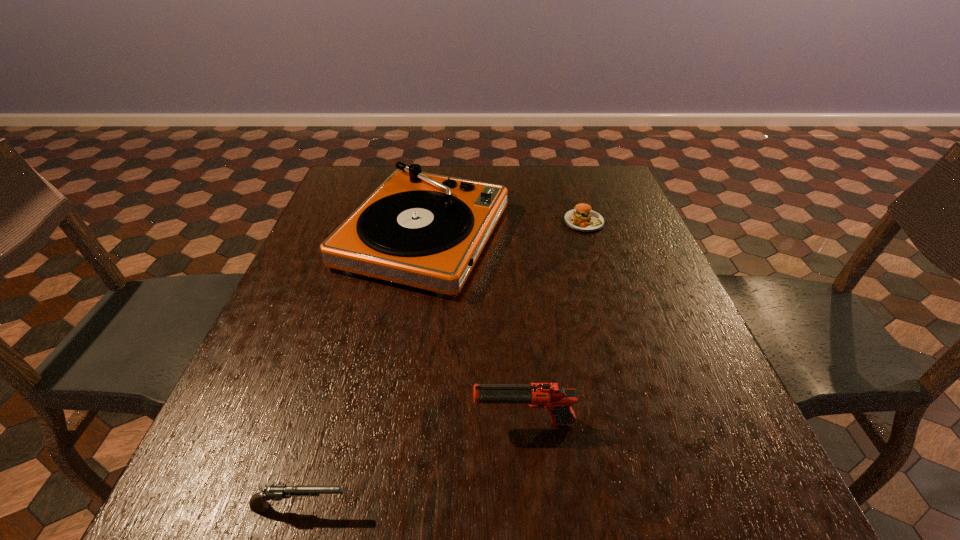
At what (x,y) coordinates should I click in order to perform the action: click on vacant space that's between the record player and the rightmost object. Please return your answer as a coordinate pair (x, y). The image size is (960, 540). Looking at the image, I should click on (504, 228).

In order to click on vacant point located between the record player and the farther gun in this screenshot , I will do `click(474, 329)`.

Find the location of a particular element. This screenshot has width=960, height=540. free area in between the second shortest object and the right gun is located at coordinates (413, 465).

This screenshot has width=960, height=540. I want to click on blank region between the record player and the rightmost object, so pyautogui.click(x=504, y=228).

Locate which object ranks third in proximity to the patty. Please provide its 2D coordinates. Your answer should be formatted as a tuple, i.e. [(x, y)], where the tuple contains the x and y coordinates of a point satisfying the conditions above.

[(258, 502)]

Locate an element on the screen. The image size is (960, 540). object that is the closest to the record player is located at coordinates (582, 218).

Locate an element on the screen. free point that satisfies the following two spatial constraints: 1. on the front side of the rightmost object; 2. at the aiming end of the right gun is located at coordinates (647, 423).